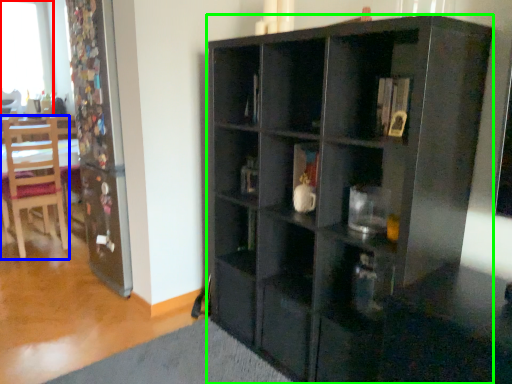
Question: Considering the real-world distances, which object is farthest from window (highlighted by a red box)? chair (highlighted by a blue box) or cabinetry (highlighted by a green box)?

Choices:
 (A) chair
 (B) cabinetry

Answer: (B)